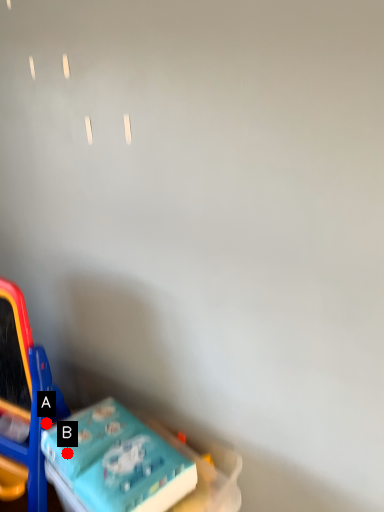
Question: Two points are circled on the image, labeled by A and B beside each circle. Which point appears closest to the camera in this image?

Choices:
 (A) A is closer
 (B) B is closer

Answer: (B)